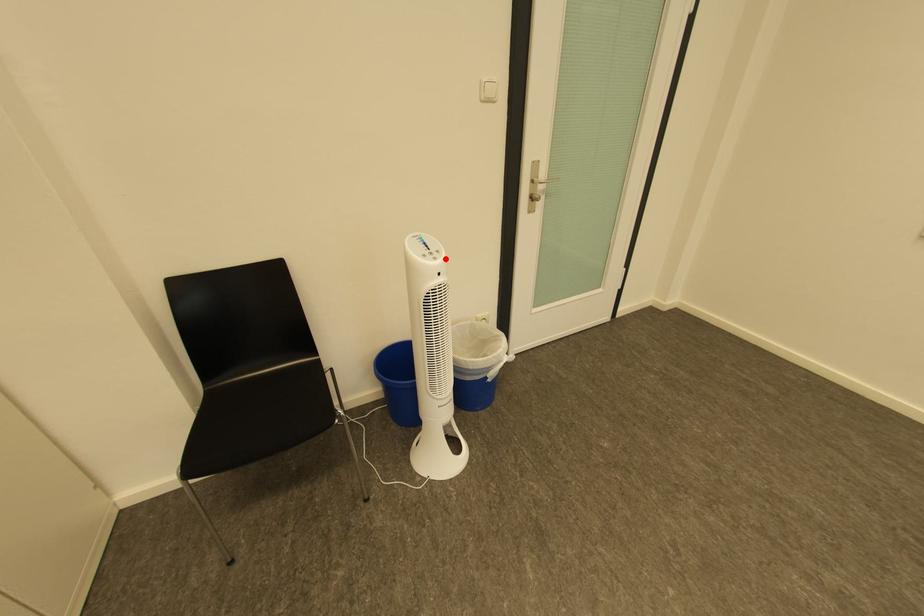
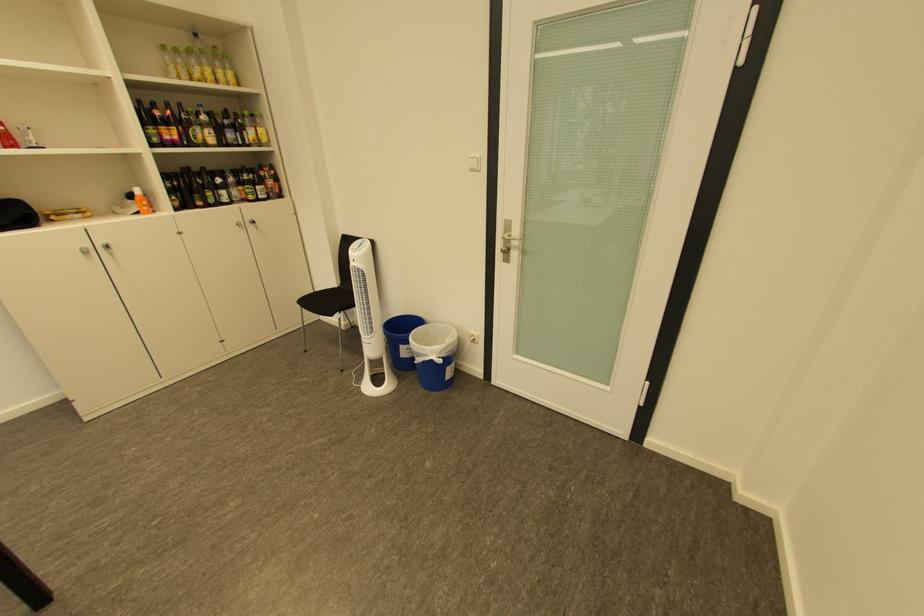
Where in the second image is the point corresponding to the highlighted location from the first image?

(363, 253)